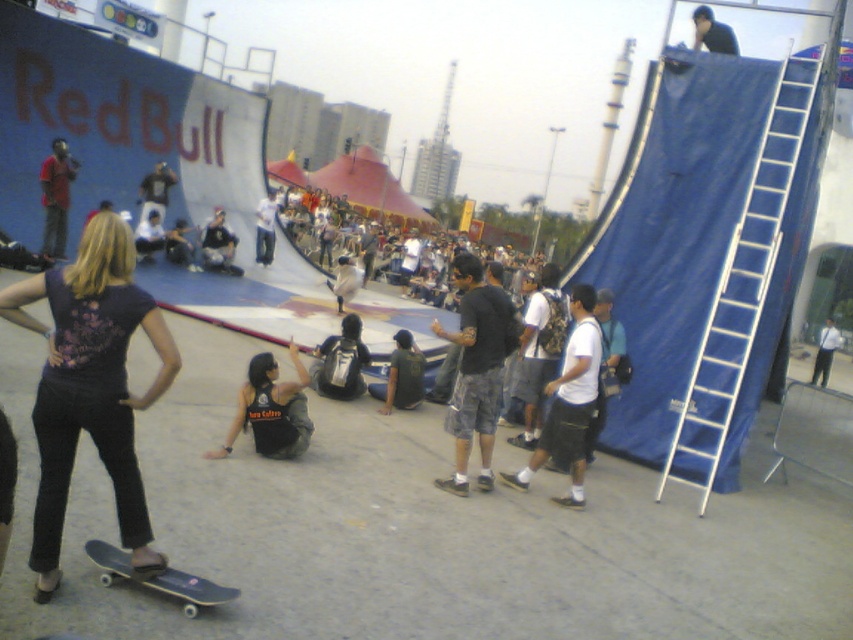
Question: Which of the following is the farthest from the observer?

Choices:
 (A) (138, 579)
 (B) (247, 394)
 (C) (204, 257)

Answer: (C)

Question: Can you confirm if dark green t-shirt at center is thinner than light blue jeans at center?

Choices:
 (A) yes
 (B) no

Answer: (A)

Question: Can you confirm if black matte shirt at upper center is positioned above dark blue t-shirt at center?

Choices:
 (A) no
 (B) yes

Answer: (B)

Question: Which point is closer to the camera?

Choices:
 (A) dark purple shirt at center
 (B) matte black shirt at upper left

Answer: (A)

Question: Does black mesh tank top at center appear under white shirt at right?

Choices:
 (A) no
 (B) yes

Answer: (B)

Question: Which of the following is the closest to the observer?

Choices:
 (A) dark blue jeans at center
 (B) dark purple shirt at center
 (C) dark blue t-shirt at center

Answer: (B)